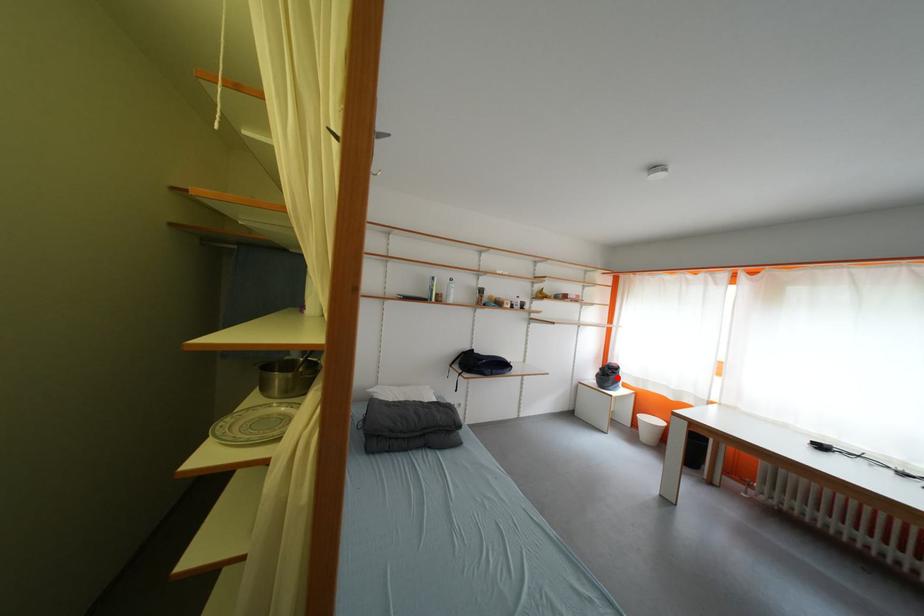
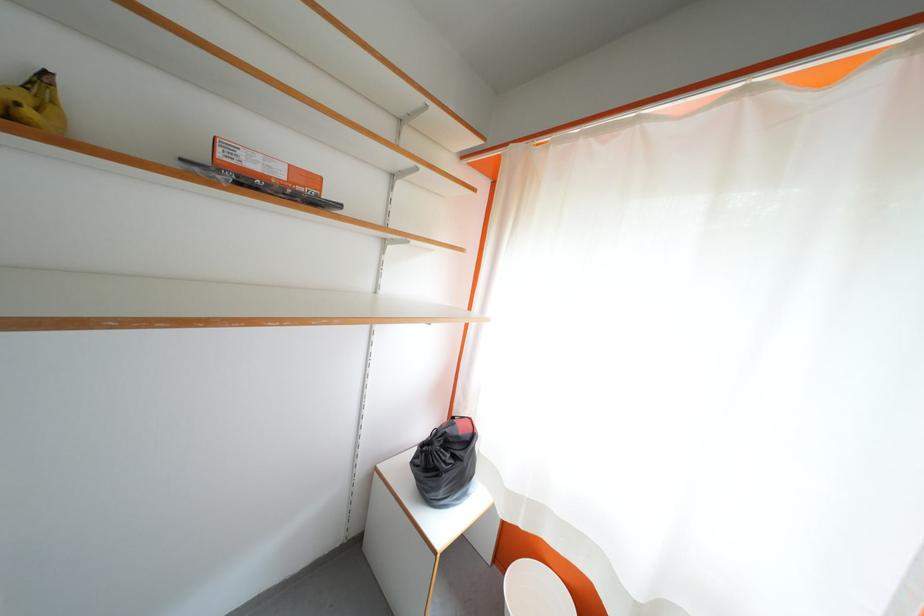
The point at the highlighted location is marked in the first image. Where is the corresponding point in the second image?

(455, 460)